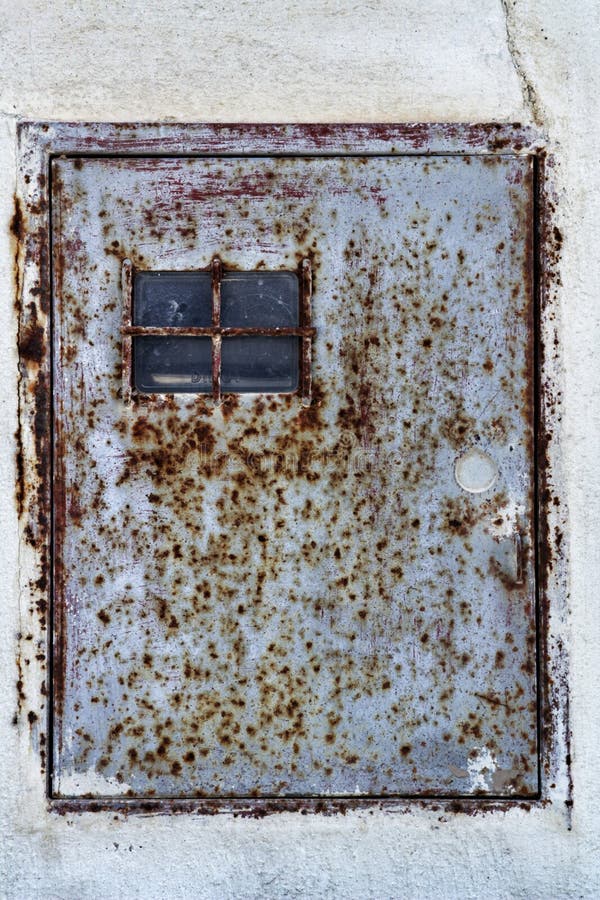
What are the coordinates of `small handle` in the screenshot? It's located at (519, 568).